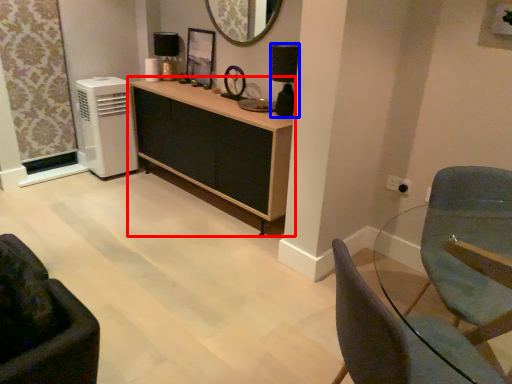
Question: Which object appears closest to the camera in this image, cabinetry (highlighted by a red box) or lamp (highlighted by a blue box)?

Choices:
 (A) cabinetry
 (B) lamp

Answer: (A)